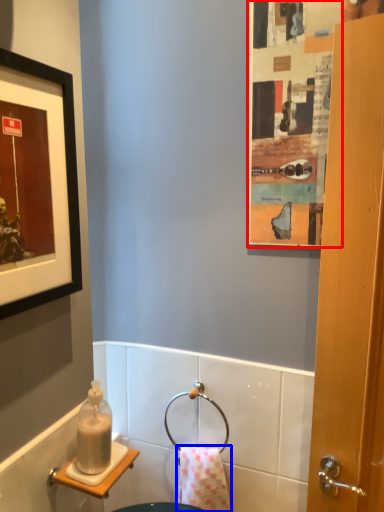
Question: Which point is further to the camera, poster (highlighted by a red box) or towel/napkin (highlighted by a blue box)?

Choices:
 (A) poster
 (B) towel/napkin

Answer: (B)